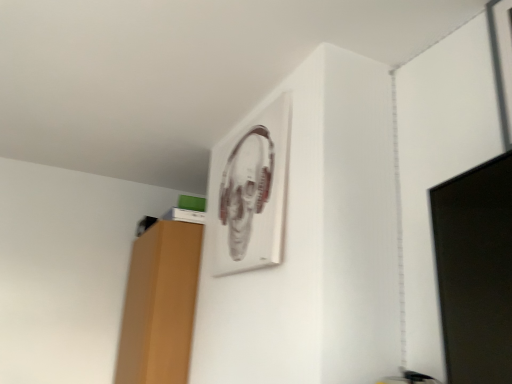
Question: Should I look upward or downward to see black glossy monitor at right?

Choices:
 (A) up
 (B) down

Answer: (B)

Question: Can you confirm if metallic silver picture frame at upper center is shorter than black glossy monitor at right?

Choices:
 (A) no
 (B) yes

Answer: (A)

Question: From a real-world perspective, is metallic silver picture frame at upper center located beneath black glossy monitor at right?

Choices:
 (A) yes
 (B) no

Answer: (B)

Question: Is the position of metallic silver picture frame at upper center less distant than that of black glossy monitor at right?

Choices:
 (A) no
 (B) yes

Answer: (A)

Question: Can you confirm if metallic silver picture frame at upper center is taller than black glossy monitor at right?

Choices:
 (A) no
 (B) yes

Answer: (B)

Question: Can you confirm if metallic silver picture frame at upper center is wider than black glossy monitor at right?

Choices:
 (A) no
 (B) yes

Answer: (A)

Question: Are metallic silver picture frame at upper center and black glossy monitor at right far apart?

Choices:
 (A) yes
 (B) no

Answer: (B)

Question: Is black glossy monitor at right facing away from metallic silver picture frame at upper center?

Choices:
 (A) yes
 (B) no

Answer: (B)

Question: From the image's perspective, is black glossy monitor at right on metallic silver picture frame at upper center?

Choices:
 (A) no
 (B) yes

Answer: (A)

Question: Is black glossy monitor at right positioned before metallic silver picture frame at upper center?

Choices:
 (A) no
 (B) yes

Answer: (B)

Question: Does black glossy monitor at right have a larger size compared to metallic silver picture frame at upper center?

Choices:
 (A) yes
 (B) no

Answer: (A)

Question: Is black glossy monitor at right aimed at metallic silver picture frame at upper center?

Choices:
 (A) yes
 (B) no

Answer: (B)

Question: Is metallic silver picture frame at upper center completely or partially inside black glossy monitor at right?

Choices:
 (A) yes
 (B) no

Answer: (B)

Question: Looking at their shapes, would you say black glossy monitor at right is wider or thinner than metallic silver picture frame at upper center?

Choices:
 (A) wide
 (B) thin

Answer: (A)